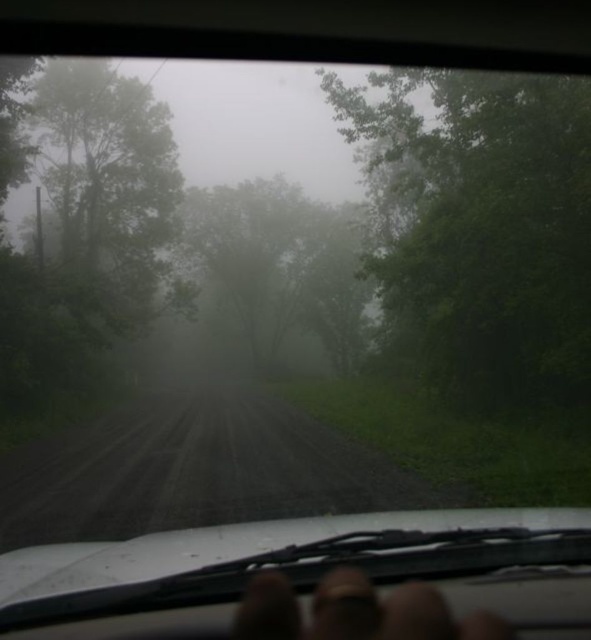
You are driving a car and looking through the windshield. There is a point marked at coordinates (80, 220). What object is located at that point?

The point at coordinates (80, 220) marks a green leafy tree at the left side of the road.

You are driving a car and want to know which tree is nearer to your car. Which one is closer between the green leafy tree at left and the green matte tree at center?

The green leafy tree at left is closer to the viewer than the green matte tree at center, so the green leafy tree at left is closer to your car.

You are driving a car and want to know if the point at coordinates point [394,88] is ahead of or behind the point at coordinates point [249,493] from your current position. Based on the scene description, which one is further away from you?

Point [394,88] is behind point [249,493], so it is further away from you.